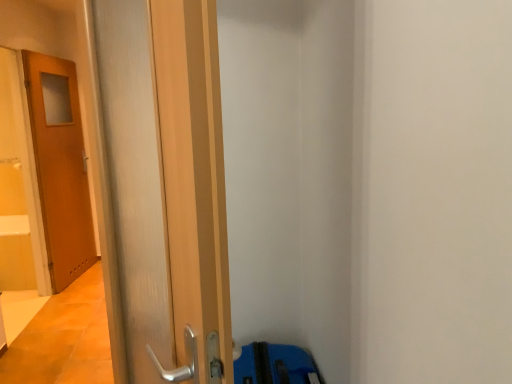
Question: Is wooden door at left, marked as the second door in a front-to-back arrangement, positioned in front of wooden door at left, the second door in the back-to-front sequence?

Choices:
 (A) yes
 (B) no

Answer: (B)

Question: Does wooden door at left, the second door when ordered from right to left, appear on the left side of wooden door at left, the 2th door positioned from the left?

Choices:
 (A) no
 (B) yes

Answer: (B)

Question: Is wooden door at left, marked as the second door in a front-to-back arrangement, outside wooden door at left, the 2th door positioned from the left?

Choices:
 (A) yes
 (B) no

Answer: (A)

Question: Does wooden door at left, the second door when ordered from right to left, have a greater height compared to wooden door at left, the 2th door positioned from the left?

Choices:
 (A) no
 (B) yes

Answer: (B)

Question: Does wooden door at left, the 1th door in the back-to-front sequence, appear on the right side of wooden door at left, the first door when ordered from front to back?

Choices:
 (A) no
 (B) yes

Answer: (A)

Question: Is wooden door at left, the 1th door in the back-to-front sequence, behind wooden door at left, the second door in the back-to-front sequence?

Choices:
 (A) no
 (B) yes

Answer: (B)

Question: Could you tell me if wooden door at left, the 1th door when ordered from right to left, is turned towards wooden door at left, the 1th door in the back-to-front sequence?

Choices:
 (A) no
 (B) yes

Answer: (A)

Question: Is wooden door at left, the 2th door positioned from the left, not close to wooden door at left, marked as the second door in a front-to-back arrangement?

Choices:
 (A) yes
 (B) no

Answer: (A)

Question: Is wooden door at left, marked as the second door in a front-to-back arrangement, surrounded by wooden door at left, the 2th door positioned from the left?

Choices:
 (A) no
 (B) yes

Answer: (A)

Question: From the image's perspective, is wooden door at left, the 1th door when ordered from right to left, located beneath wooden door at left, the second door when ordered from right to left?

Choices:
 (A) yes
 (B) no

Answer: (A)

Question: Is wooden door at left, the 2th door positioned from the left, positioned with its back to wooden door at left, the 1th door in the back-to-front sequence?

Choices:
 (A) no
 (B) yes

Answer: (A)

Question: Is wooden door at left, the 2th door positioned from the left, behind wooden door at left, marked as the second door in a front-to-back arrangement?

Choices:
 (A) no
 (B) yes

Answer: (A)

Question: Is wooden door at left, the first door when ordered from front to back, to the left or to the right of wooden door at left, positioned as the 1th door in left-to-right order, in the image?

Choices:
 (A) right
 (B) left

Answer: (A)